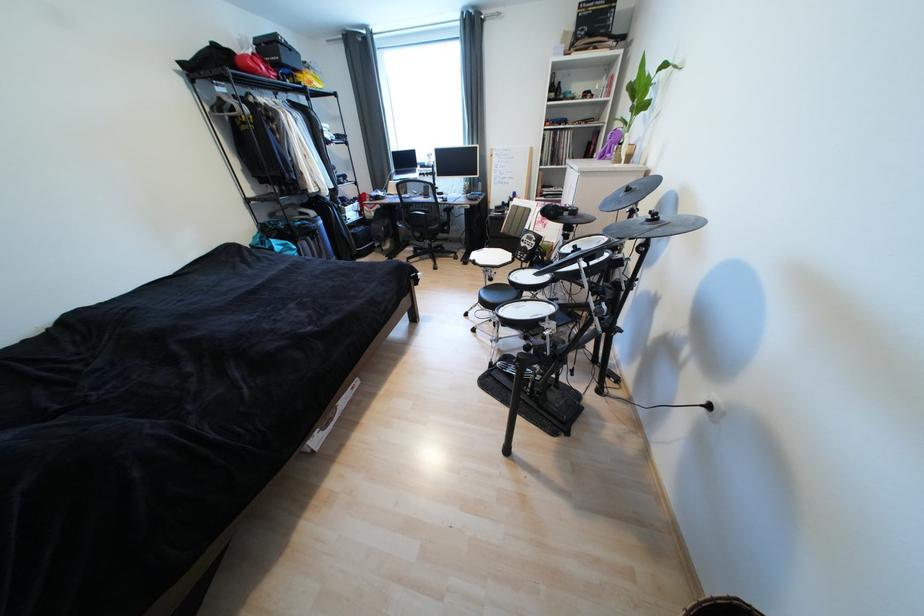
The image size is (924, 616). In order to click on black stool sitting surface in this screenshot , I will do `click(496, 294)`.